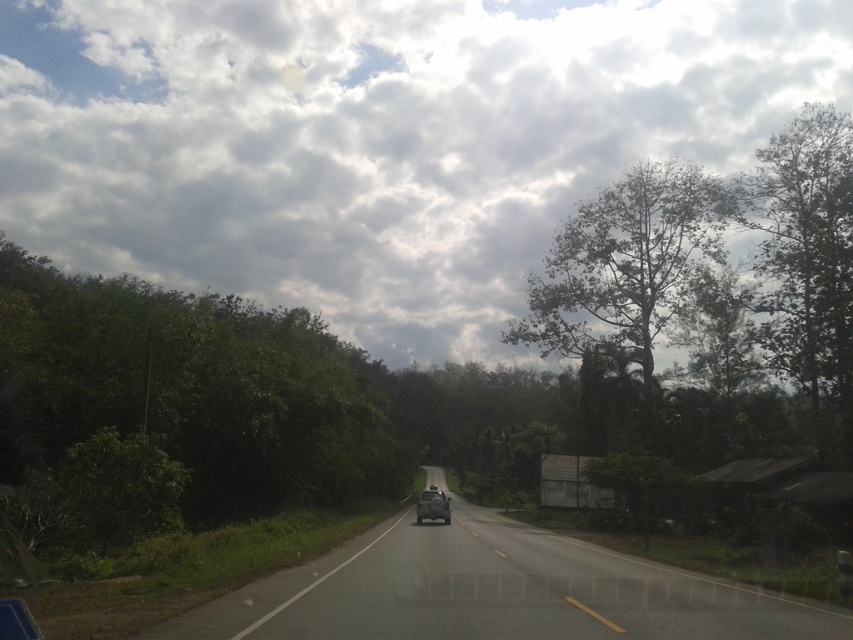
Question: Considering the relative positions of asphalt road at center and green leafy tree at upper right in the image provided, where is asphalt road at center located with respect to green leafy tree at upper right?

Choices:
 (A) left
 (B) right

Answer: (A)

Question: Does green leafy tree at upper right appear on the right side of shiny silver car at center?

Choices:
 (A) no
 (B) yes

Answer: (B)

Question: Is asphalt road at center behind green leafy tree at upper right?

Choices:
 (A) yes
 (B) no

Answer: (B)

Question: Which is farther from the matte black motorcycle at center?

Choices:
 (A) shiny silver car at center
 (B) asphalt road at center
 (C) cloudy sky at upper center
 (D) green leafy tree at upper right

Answer: (C)

Question: Which is nearer to the cloudy sky at upper center?

Choices:
 (A) green leafy tree at upper right
 (B) green leafy tree at right

Answer: (A)

Question: Estimate the real-world distances between objects in this image. Which object is farther from the shiny silver car at center?

Choices:
 (A) asphalt road at center
 (B) cloudy sky at upper center
 (C) green leafy tree at right

Answer: (B)